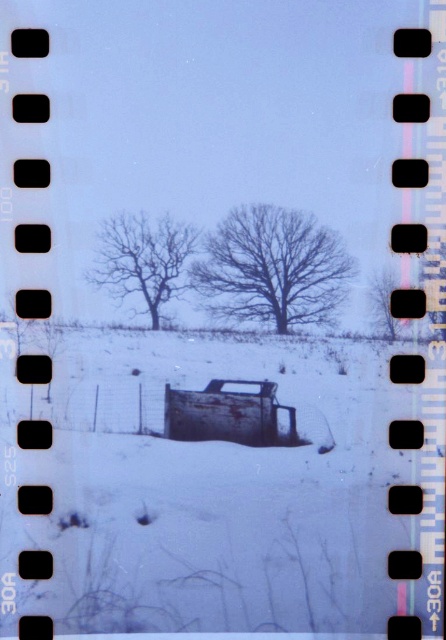
Question: Is bare branches at center in front of smooth brown tree at center?

Choices:
 (A) no
 (B) yes

Answer: (B)

Question: Which point appears farthest from the camera in this image?

Choices:
 (A) (294, 433)
 (B) (380, 305)
 (C) (347, 273)

Answer: (A)

Question: Is bare wood tree at center smaller than rusty metal truck at center?

Choices:
 (A) yes
 (B) no

Answer: (B)

Question: Estimate the real-world distances between objects in this image. Which object is closer to the rusty metal truck at center?

Choices:
 (A) bare wood tree at center
 (B) bare branches at center

Answer: (A)

Question: Is bare wood tree at center above smooth brown tree at center?

Choices:
 (A) no
 (B) yes

Answer: (B)

Question: Which object is closer to the camera taking this photo?

Choices:
 (A) rusty metal truck at center
 (B) bare branches at center
 (C) smooth brown tree at center
 (D) bare wood tree at center

Answer: (B)